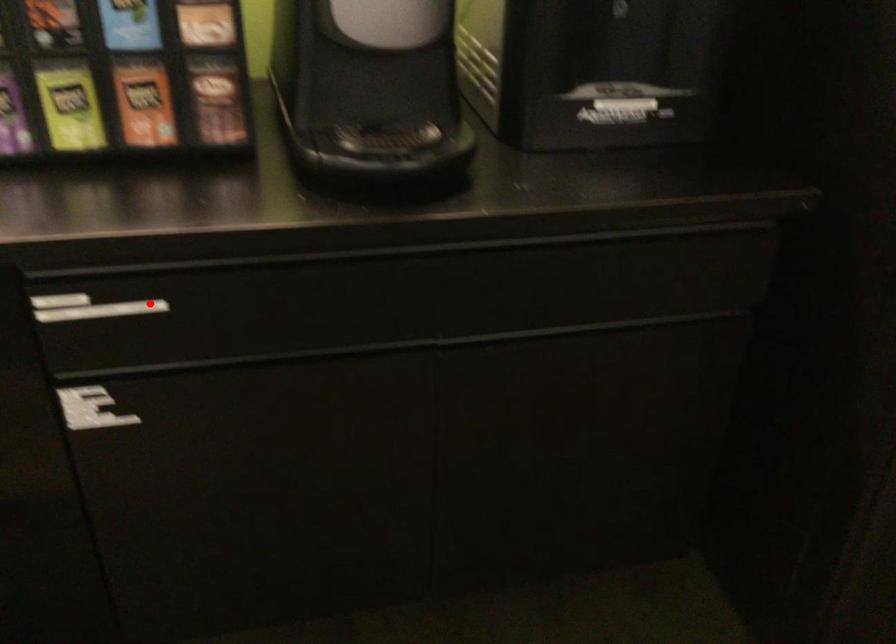
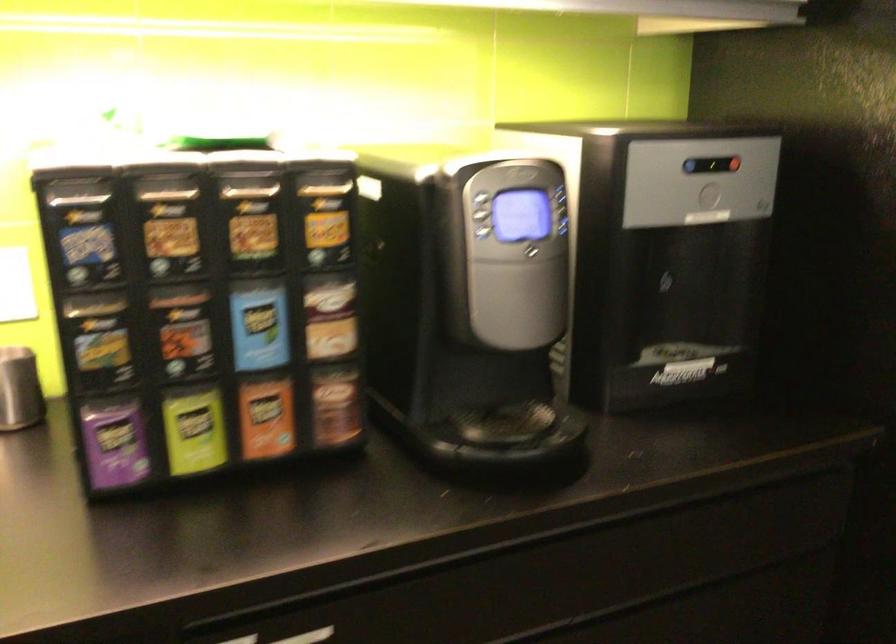
Where in the second image is the point corresponding to the highlighted location from the first image?

(308, 636)